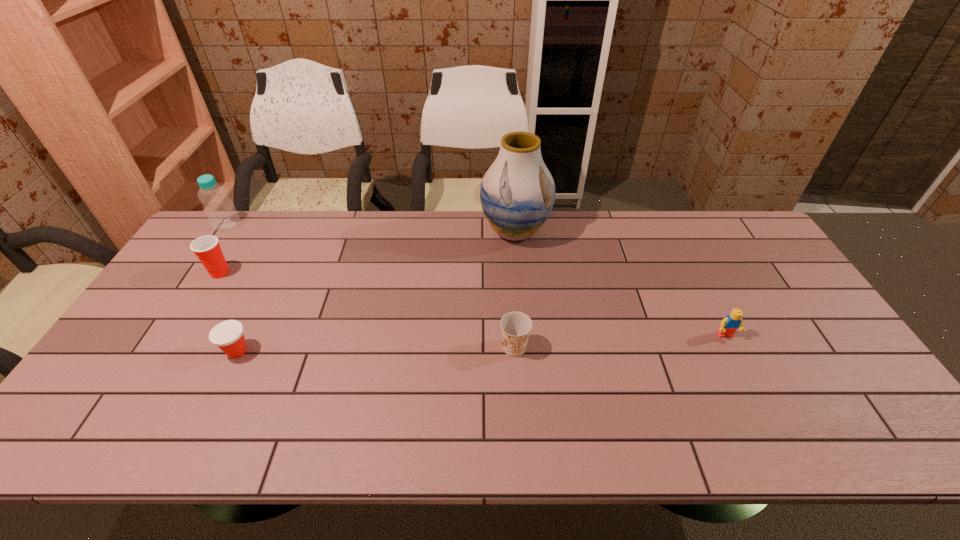
I want to click on the tallest object, so click(x=517, y=193).

Where is `the fifth shortest object`? The image size is (960, 540). the fifth shortest object is located at coordinates (219, 209).

The width and height of the screenshot is (960, 540). I want to click on the fourth shortest object, so click(x=207, y=248).

Identify the location of the leftmost Dixie cup. The image size is (960, 540). coord(207,248).

Find the location of a particular element. the rightmost object is located at coordinates (733, 321).

This screenshot has width=960, height=540. What are the coordinates of `the second shortest Dixie cup` in the screenshot? It's located at (515, 326).

Locate an element on the screen. the shortest object is located at coordinates (228, 335).

You are a GUI agent. You are given a task and a screenshot of the screen. Output one action in this format:
    pyautogui.click(x=<x>, y=<y>)
    Task: Click on the shortest Dixie cup
    
    Given the screenshot: What is the action you would take?
    pyautogui.click(x=228, y=335)

Where is `free space located on the front of the vase`? free space located on the front of the vase is located at coordinates (519, 280).

The width and height of the screenshot is (960, 540). Identify the location of free region located on the front of the bottle. (184, 290).